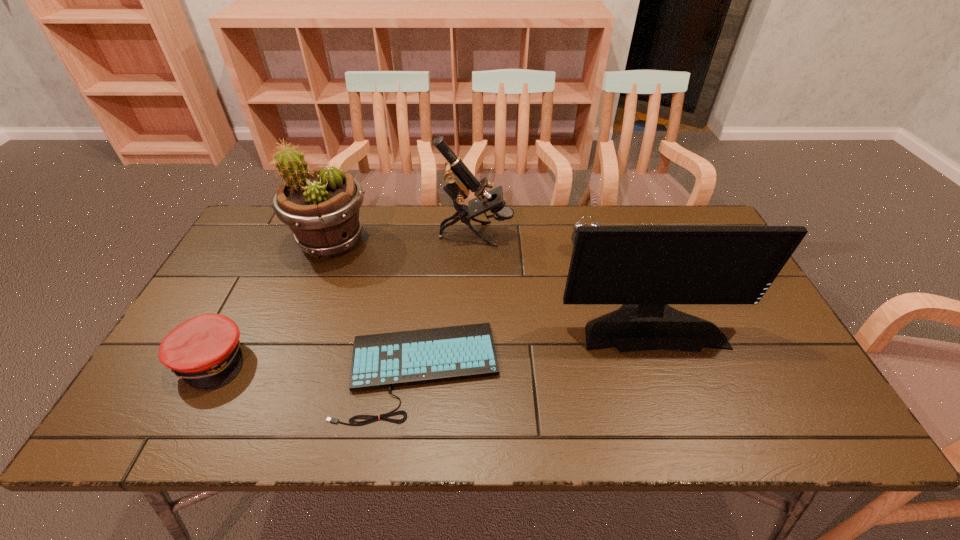
At what (x,y) coordinates should I click in order to perform the action: click on free space at the far edge of the desktop. Please return your answer as a coordinate pair (x, y). This screenshot has height=540, width=960. Looking at the image, I should click on (563, 211).

The image size is (960, 540). Identify the location of vacant space at the near edge of the desktop. (279, 417).

In the image, there is a desktop. At what (x,y) coordinates should I click in order to perform the action: click on free space at the left edge. Please return your answer as a coordinate pair (x, y). The height and width of the screenshot is (540, 960). Looking at the image, I should click on (x=245, y=285).

In the image, there is a desktop. What are the coordinates of `vacant space at the near right corner` in the screenshot? It's located at (828, 423).

Find the location of a particular element. This screenshot has width=960, height=540. vacant space in between the third shortest object and the computer keyboard is located at coordinates (501, 310).

Where is `free space between the alarm clock and the computer keyboard`? This screenshot has height=540, width=960. free space between the alarm clock and the computer keyboard is located at coordinates (501, 310).

Identify the location of free spot between the shortest object and the second shortest object. (316, 364).

The image size is (960, 540). I want to click on free spot between the fourth tallest object and the computer keyboard, so click(501, 310).

Where is `free space between the monitor and the flowerpot`? The height and width of the screenshot is (540, 960). free space between the monitor and the flowerpot is located at coordinates (491, 281).

At what (x,y) coordinates should I click in order to perform the action: click on vacant space that's between the alarm clock and the flowerpot. Please return your answer as a coordinate pair (x, y). The height and width of the screenshot is (540, 960). Looking at the image, I should click on (457, 246).